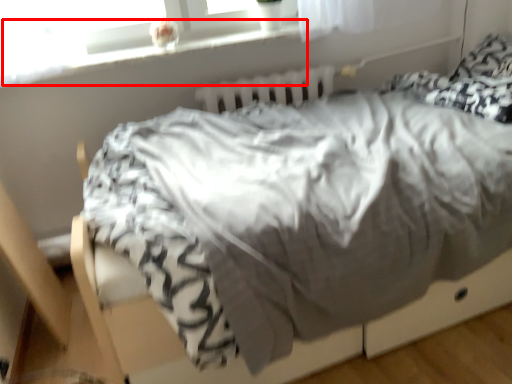
Question: From the image's perspective, what is the correct spatial positioning of window sill (annotated by the red box) in reference to radiator?

Choices:
 (A) below
 (B) above

Answer: (B)